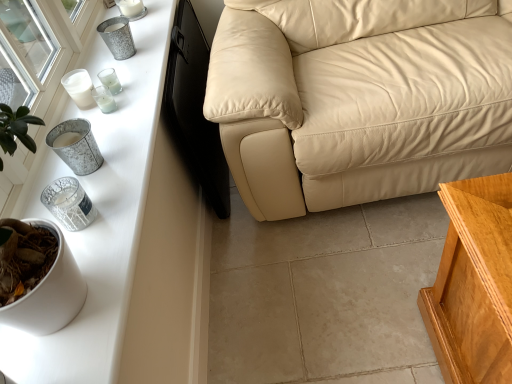
Find the location of `free point to the right of metallic glass candle holder at upper left, which is the second candle holder from top to bottom`. free point to the right of metallic glass candle holder at upper left, which is the second candle holder from top to bottom is located at coordinates (144, 86).